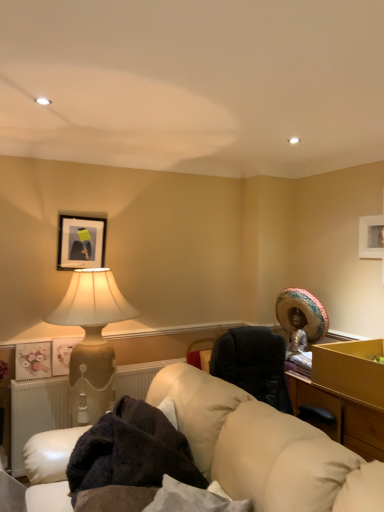
Question: Can you confirm if dark brown plush blanket at lower center is positioned to the left of matte gold picture frame at left, which is the 2th picture frame in bottom-to-top order?

Choices:
 (A) no
 (B) yes

Answer: (A)

Question: Can you confirm if dark brown plush blanket at lower center is smaller than matte gold picture frame at left, which is the 2th picture frame in bottom-to-top order?

Choices:
 (A) yes
 (B) no

Answer: (B)

Question: Would you say dark brown plush blanket at lower center is outside matte gold picture frame at left, which ranks as the second picture frame in top-to-bottom order?

Choices:
 (A) no
 (B) yes

Answer: (B)

Question: Are dark brown plush blanket at lower center and matte gold picture frame at left, which ranks as the second picture frame in top-to-bottom order, located far from each other?

Choices:
 (A) yes
 (B) no

Answer: (A)

Question: Is dark brown plush blanket at lower center wider than matte gold picture frame at left, which is the 2th picture frame in bottom-to-top order?

Choices:
 (A) no
 (B) yes

Answer: (B)

Question: From the image's perspective, would you say dark brown plush blanket at lower center is positioned over matte gold picture frame at left, which is the 2th picture frame in bottom-to-top order?

Choices:
 (A) no
 (B) yes

Answer: (A)

Question: Is matte beige lamp at left wider than dark brown plush blanket at lower center?

Choices:
 (A) yes
 (B) no

Answer: (A)

Question: Considering the relative sizes of matte beige lamp at left and dark brown plush blanket at lower center in the image provided, is matte beige lamp at left shorter than dark brown plush blanket at lower center?

Choices:
 (A) no
 (B) yes

Answer: (A)

Question: Considering the relative positions of matte beige lamp at left and dark brown plush blanket at lower center in the image provided, is matte beige lamp at left to the left of dark brown plush blanket at lower center from the viewer's perspective?

Choices:
 (A) yes
 (B) no

Answer: (A)

Question: From a real-world perspective, is matte beige lamp at left under dark brown plush blanket at lower center?

Choices:
 (A) no
 (B) yes

Answer: (A)

Question: Is matte beige lamp at left taller than dark brown plush blanket at lower center?

Choices:
 (A) yes
 (B) no

Answer: (A)

Question: Is matte beige lamp at left facing away from dark brown plush blanket at lower center?

Choices:
 (A) yes
 (B) no

Answer: (B)

Question: Can you confirm if white radiator at lower left is taller than matte gold picture frame at left, which ranks as the second picture frame in top-to-bottom order?

Choices:
 (A) yes
 (B) no

Answer: (A)